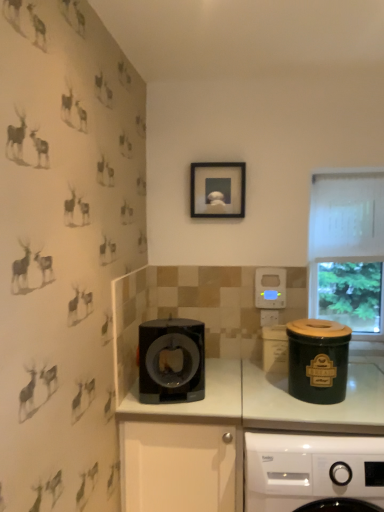
The width and height of the screenshot is (384, 512). What do you see at coordinates (311, 469) in the screenshot?
I see `green ceramic canister at right` at bounding box center [311, 469].

Find the location of a particular element. This screenshot has height=512, width=384. transparent glass window at upper right is located at coordinates (347, 249).

What do you see at coordinates (318, 360) in the screenshot? This screenshot has height=512, width=384. I see `green ceramic canister at right` at bounding box center [318, 360].

Identify the location of black plastic drawer at center. The image size is (384, 512). (177, 466).

Image resolution: width=384 pixels, height=512 pixels. Describe the element at coordinates (177, 466) in the screenshot. I see `black plastic drawer at center` at that location.

The width and height of the screenshot is (384, 512). Identify the location of green ceramic canister at right. (311, 469).

From the picture: Does transparent glass window at upper right lie in front of black glossy coffee maker at center?

No, the depth of transparent glass window at upper right is greater than that of black glossy coffee maker at center.

Is transparent glass window at upper right directly adjacent to black glossy coffee maker at center?

No.

Is transparent glass window at upper right taller than black glossy coffee maker at center?

Correct, transparent glass window at upper right is much taller as black glossy coffee maker at center.

You are a GUI agent. You are given a task and a screenshot of the screen. Output one action in this format:
    pyautogui.click(x=<x>, y=<y>)
    Task: Click on the window behind the black glossy coffee maker at center
    
    Given the screenshot: What is the action you would take?
    pyautogui.click(x=347, y=249)

From the image's perspective, which is above, black matte picture frame at upper center or black glossy coffee maker at center?

black matte picture frame at upper center appears higher in the image.

Which is more to the right, black matte picture frame at upper center or black glossy coffee maker at center?

From the viewer's perspective, black matte picture frame at upper center appears more on the right side.

This screenshot has width=384, height=512. Find the location of `kitchen appliance lying below the black matte picture frame at upper center (from the image's perspective)`. kitchen appliance lying below the black matte picture frame at upper center (from the image's perspective) is located at coordinates [x=171, y=361].

Considering the relative sizes of black matte picture frame at upper center and black glossy coffee maker at center in the image provided, is black matte picture frame at upper center wider than black glossy coffee maker at center?

Incorrect, the width of black matte picture frame at upper center does not surpass that of black glossy coffee maker at center.

Considering the relative positions of transparent glass window at upper right and green ceramic canister at right in the image provided, is transparent glass window at upper right to the left of green ceramic canister at right from the viewer's perspective?

In fact, transparent glass window at upper right is to the right of green ceramic canister at right.

Is point (365, 203) positioned behind point (382, 476)?

Yes, point (365, 203) is behind point (382, 476).

Between transparent glass window at upper right and green ceramic canister at right, which one has more height?

transparent glass window at upper right is taller.

From a real-world perspective, which object stands above the other?

From a 3D spatial view, transparent glass window at upper right is above.

Could you tell me if green ceramic canister at right is facing transparent glass window at upper right?

No, green ceramic canister at right does not turn towards transparent glass window at upper right.

From the image's perspective, which one is positioned higher, green ceramic canister at right or transparent glass window at upper right?

transparent glass window at upper right, from the image's perspective.

Which object is closer to the camera taking this photo, green ceramic canister at right or transparent glass window at upper right?

green ceramic canister at right.

Which object is positioned more to the left, black matte picture frame at upper center or transparent glass window at upper right?

From the viewer's perspective, black matte picture frame at upper center appears more on the left side.

Is black matte picture frame at upper center facing away from transparent glass window at upper right?

black matte picture frame at upper center is not turned away from transparent glass window at upper right.

Can you confirm if black matte picture frame at upper center is thinner than transparent glass window at upper right?

Yes.

Is black matte picture frame at upper center bigger than transparent glass window at upper right?

Actually, black matte picture frame at upper center might be smaller than transparent glass window at upper right.

Considering the positions of objects black glossy coffee maker at center and transparent glass window at upper right in the image provided, who is more to the left, black glossy coffee maker at center or transparent glass window at upper right?

Positioned to the left is black glossy coffee maker at center.

Is black glossy coffee maker at center positioned in front of transparent glass window at upper right?

Yes, it is in front of transparent glass window at upper right.

Image resolution: width=384 pixels, height=512 pixels. I want to click on window that appears above the black glossy coffee maker at center (from a real-world perspective), so click(x=347, y=249).

From the image's perspective, which one is positioned lower, black glossy coffee maker at center or transparent glass window at upper right?

black glossy coffee maker at center is shown below in the image.

From a real-world perspective, is green ceramic canister at right located higher than black plastic drawer at center?

Correct, in the physical world, green ceramic canister at right is higher than black plastic drawer at center.

Does green ceramic canister at right have a larger size compared to black plastic drawer at center?

Incorrect, green ceramic canister at right is not larger than black plastic drawer at center.

Are green ceramic canister at right and black plastic drawer at center located far from each other?

No, green ceramic canister at right is in close proximity to black plastic drawer at center.

Locate an element on the screen. The height and width of the screenshot is (512, 384). kitchen appliance that appears in front of the transparent glass window at upper right is located at coordinates [x=171, y=361].

Where is `picture frame above the black glossy coffee maker at center (from the image's perspective)`? Image resolution: width=384 pixels, height=512 pixels. picture frame above the black glossy coffee maker at center (from the image's perspective) is located at coordinates (218, 190).

From the image, which object appears to be nearer to transparent glass window at upper right, black matte picture frame at upper center or black glossy coffee maker at center?

black matte picture frame at upper center.

Based on their spatial positions, is black glossy coffee maker at center or green ceramic canister at right closer to transparent glass window at upper right?

Based on the image, black glossy coffee maker at center appears to be nearer to transparent glass window at upper right.

Which object lies further to the anchor point green ceramic canister at right, black matte picture frame at upper center or black glossy coffee maker at center?

Based on the image, black matte picture frame at upper center appears to be further to green ceramic canister at right.

Considering their positions, is green ceramic canister at right positioned further to transparent glass window at upper right than green ceramic canister at right?

green ceramic canister at right.

Which object lies nearer to the anchor point transparent glass window at upper right, black plastic drawer at center or green ceramic canister at right?

green ceramic canister at right is closer to transparent glass window at upper right.

Estimate the real-world distances between objects in this image. Which object is further from transparent glass window at upper right, green ceramic canister at right or black glossy coffee maker at center?

black glossy coffee maker at center lies further to transparent glass window at upper right than the other object.

In the scene shown: From the image, which object appears to be nearer to black glossy coffee maker at center, transparent glass window at upper right or black matte picture frame at upper center?

Based on the image, black matte picture frame at upper center appears to be nearer to black glossy coffee maker at center.

Based on their spatial positions, is green ceramic canister at right or black matte picture frame at upper center closer to transparent glass window at upper right?

Among the two, black matte picture frame at upper center is located nearer to transparent glass window at upper right.

This screenshot has height=512, width=384. What are the coordinates of `picture frame between green ceramic canister at right and transparent glass window at upper right from front to back` in the screenshot? It's located at (218, 190).

Locate an element on the screen. This screenshot has width=384, height=512. appliance between black glossy coffee maker at center and black plastic drawer at center from top to bottom is located at coordinates (318, 360).

This screenshot has height=512, width=384. Identify the location of appliance located between green ceramic canister at right and transparent glass window at upper right in the depth direction. (318, 360).

The image size is (384, 512). I want to click on window that lies between black matte picture frame at upper center and green ceramic canister at right from top to bottom, so click(347, 249).